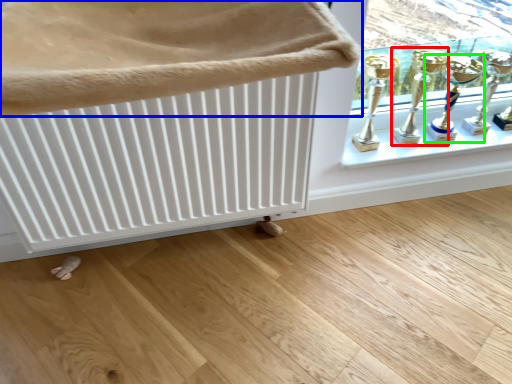
Question: Which is nearer to the trophy (highlighted by a red box)? furniture (highlighted by a blue box) or candle holder (highlighted by a green box).

Choices:
 (A) furniture
 (B) candle holder

Answer: (B)